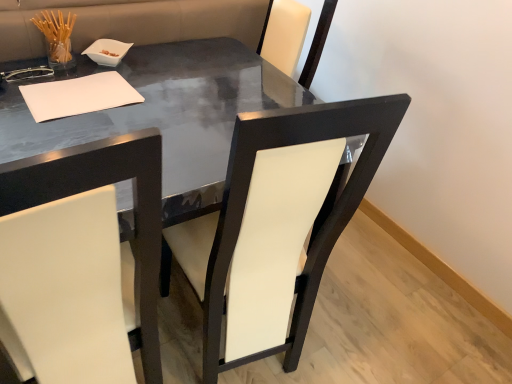
Find the location of a particular element. The height and width of the screenshot is (384, 512). free spot behind white paper at upper left is located at coordinates (137, 71).